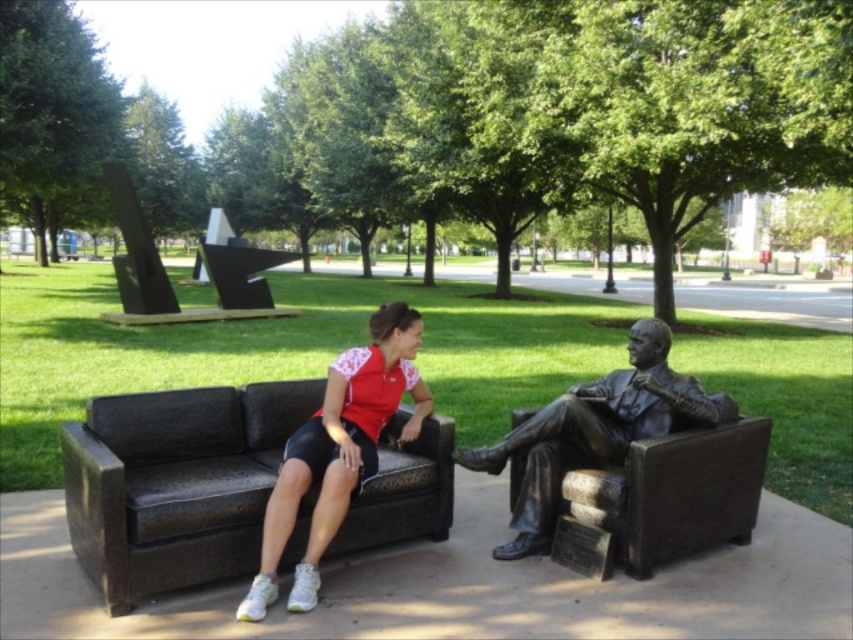
You are planning to place a rectangular table between the dark brown leather couch at center and the bronze statue at right. The table is 1.2 meters wide. Can the table fit between them if the space between the two objects is exactly the width of the wider object?

The dark brown leather couch at center is wider than the bronze statue at right. Since the space between them is the width of the wider object, which is the dark brown leather couch at center, the table that is 1.2 meters wide can fit if the couch is at least 1.2 meters wide. However, the exact width of the couch isn

You are standing in the park and see the dark brown leather couch at center and the matte red shirt at center. Which object is located to the left side of the other?

The dark brown leather couch at center is positioned on the left side of matte red shirt at center.